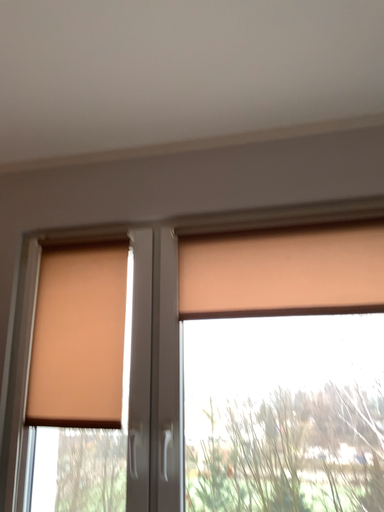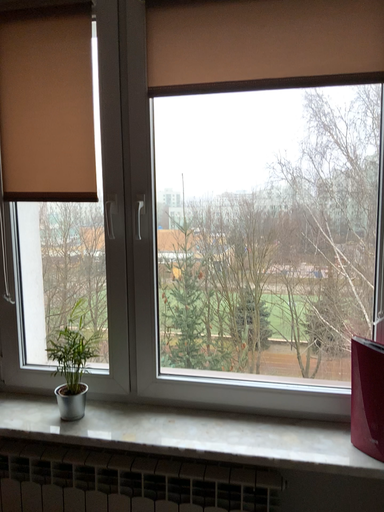
Question: Which way did the camera rotate in the video?

Choices:
 (A) rotated downward
 (B) rotated upward

Answer: (A)